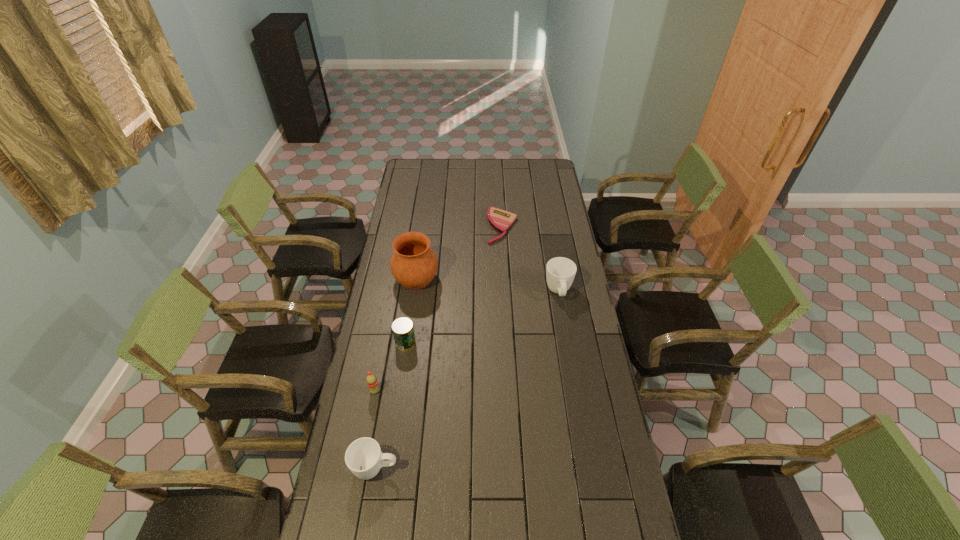
In order to click on the nearer cup in this screenshot , I will do `click(364, 458)`.

Locate an element on the screen. The width and height of the screenshot is (960, 540). the shorter cup is located at coordinates (364, 458).

Find the location of a particular element. The image size is (960, 540). the rightmost object is located at coordinates (560, 272).

At what (x,y) coordinates should I click in order to perform the action: click on the taller cup. Please return your answer as a coordinate pair (x, y). Looking at the image, I should click on (560, 272).

This screenshot has width=960, height=540. What are the coordinates of `the shortest object` in the screenshot? It's located at (500, 220).

You are a GUI agent. You are given a task and a screenshot of the screen. Output one action in this format:
    pyautogui.click(x=<x>, y=<y>)
    Task: Click on the wristlet
    Image resolution: width=960 pixels, height=540 pixels.
    Given the screenshot: What is the action you would take?
    pyautogui.click(x=500, y=220)

The image size is (960, 540). Identify the location of pottery. (414, 264).

What are the coordinates of `soda` in the screenshot? It's located at (371, 380).

Identify the location of the third nearest object. The width and height of the screenshot is (960, 540). (403, 331).

This screenshot has width=960, height=540. Identify the location of free space located with the handle on the side of the nearest object. (427, 469).